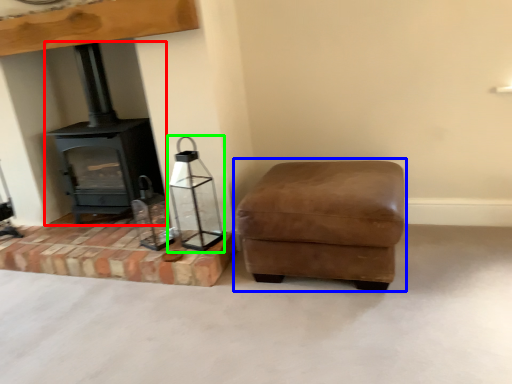
Question: Estimate the real-world distances between objects in this image. Which object is closer to wood burning stove (highlighted by a red box), rocking chair (highlighted by a blue box) or candle holder (highlighted by a green box)?

Choices:
 (A) rocking chair
 (B) candle holder

Answer: (B)